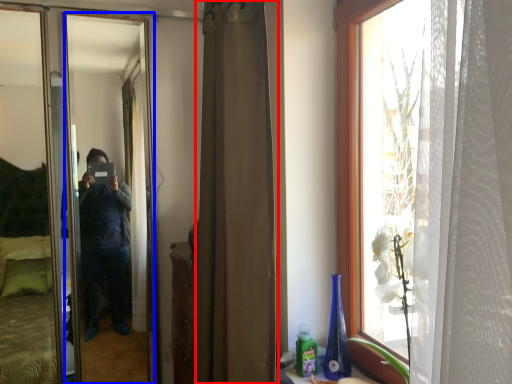
Question: Which of the following is the closest to the observer, curtain (highlighted by a red box) or mirror (highlighted by a blue box)?

Choices:
 (A) curtain
 (B) mirror

Answer: (A)